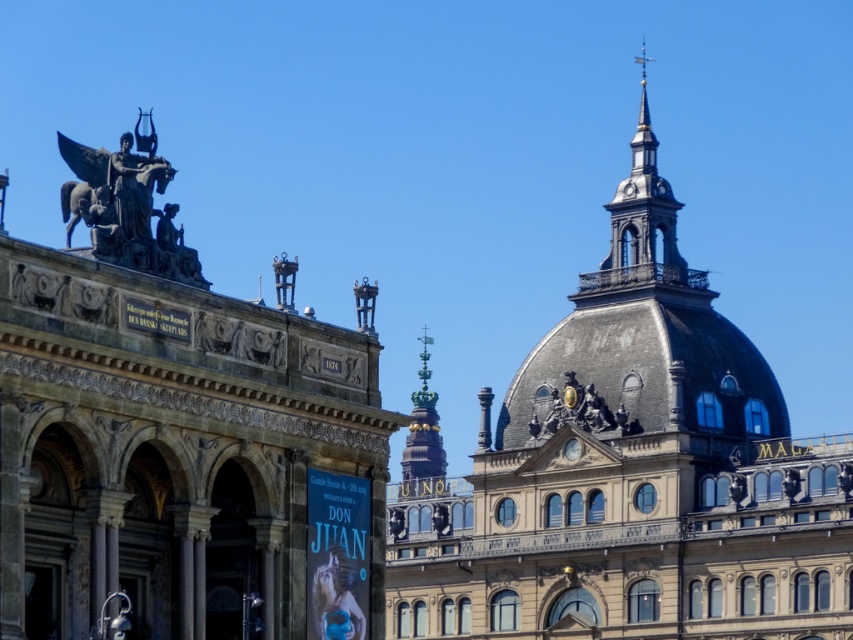
Describe the element at coordinates (630, 474) in the screenshot. The height and width of the screenshot is (640, 853). I see `smooth gray dome at upper center` at that location.

Find the location of a particular element. smooth gray dome at upper center is located at coordinates (630, 474).

Between point (613, 497) and point (161, 172), which one is positioned behind?

The point (613, 497) is more distant.

Identify the location of smooth gray dome at upper center. (630, 474).

Which is behind, point (737, 352) or point (631, 426)?

The point (737, 352) is behind.

Does smooth gray dome at upper center have a greater height compared to bronze statue at upper center?

Yes.

What do you see at coordinates (630, 474) in the screenshot?
I see `smooth gray dome at upper center` at bounding box center [630, 474].

Identify the location of smooth gray dome at upper center. The image size is (853, 640). (630, 474).

Does point (68, 188) come behind point (596, 433)?

No, it is not.

Does bronze/statue at upper left appear under bronze statue at upper center?

Actually, bronze/statue at upper left is above bronze statue at upper center.

You are a GUI agent. You are given a task and a screenshot of the screen. Output one action in this format:
    pyautogui.click(x=<x>, y=<y>)
    Task: Click on the bronze/statue at upper left
    Image resolution: width=853 pixels, height=640 pixels.
    Given the screenshot: What is the action you would take?
    pyautogui.click(x=126, y=205)

Find the location of a particular element. bronze/statue at upper left is located at coordinates pyautogui.click(x=126, y=205).